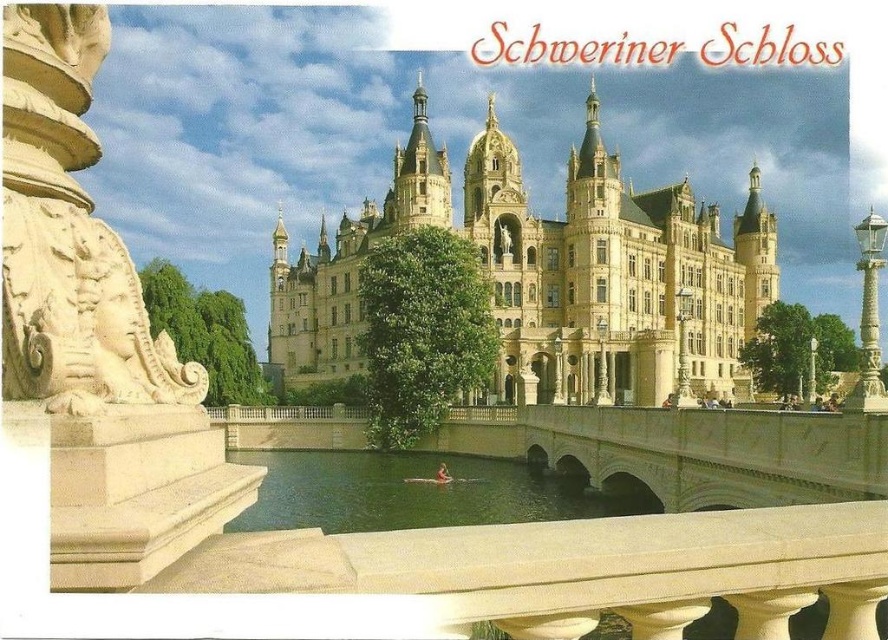
You are standing on the stone bridge in front of the Schweriner Schloss. You see the yellow stone castle at center and the green water at center. Which object is positioned to the right of the other?

The yellow stone castle at center is to the right of green water at center according to the description.

A tourist is standing on the stone bridge in the foreground and wants to take a photo of the yellow stone castle at center. If the tourist wants to include both the stone bridge and the castle in the photo, should they zoom in or zoom out?

The tourist should zoom out to include both the stone bridge and the yellow stone castle at center in the photo since they are 106.97 meters apart, which requires a wider angle to capture both in the frame.